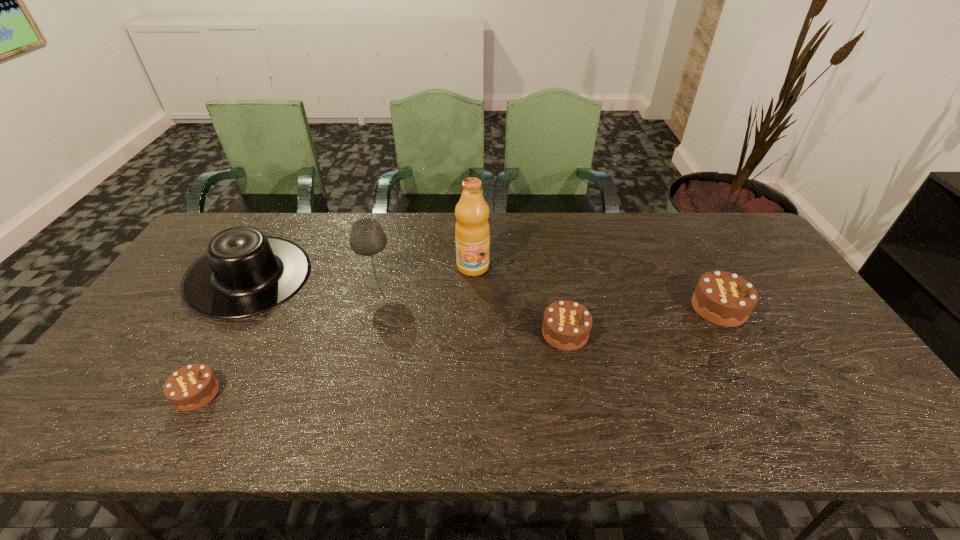
Locate an element on the screen. free location that satisfies the following two spatial constraints: 1. on the front label of the second chocolate cake from right to left; 2. on the left side of the tallest object is located at coordinates (471, 333).

Locate an element on the screen. The width and height of the screenshot is (960, 540). vacant position in the image that satisfies the following two spatial constraints: 1. on the front side of the second chocolate cake from right to left; 2. on the right side of the fourth shortest object is located at coordinates (217, 333).

Identify the location of free space that satisfies the following two spatial constraints: 1. on the front label of the fruit juice; 2. on the left side of the second chocolate cake from right to left. (471, 333).